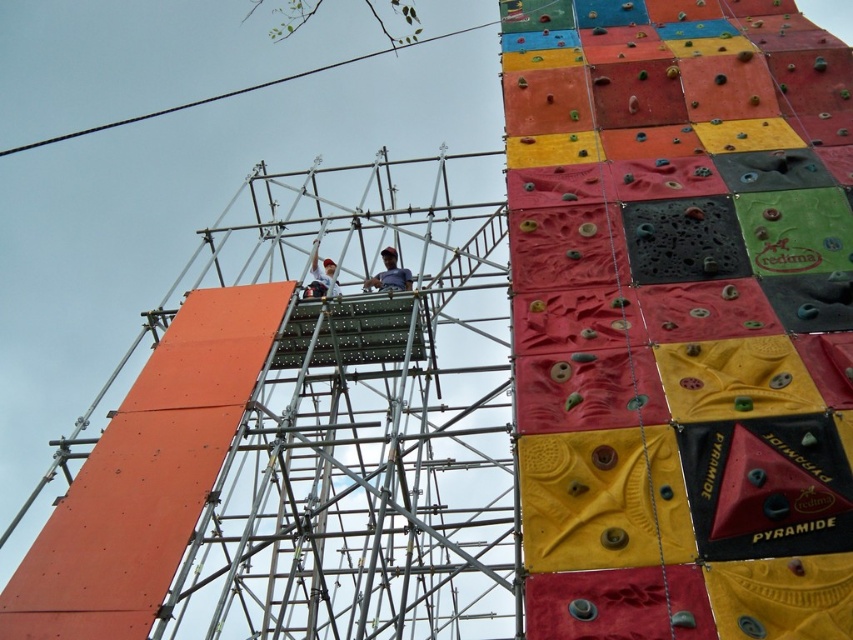
Question: Which object appears farthest from the camera in this image?

Choices:
 (A) metallic scaffolding at center
 (B) matte black helmet at center

Answer: (B)

Question: Can you confirm if metallic scaffolding at center is positioned to the right of white matte shirt at center?

Choices:
 (A) yes
 (B) no

Answer: (B)

Question: Does matte black helmet at center appear under white matte shirt at center?

Choices:
 (A) yes
 (B) no

Answer: (A)

Question: Can you confirm if matte black helmet at center is thinner than white matte shirt at center?

Choices:
 (A) yes
 (B) no

Answer: (B)

Question: Which of the following is the farthest from the observer?

Choices:
 (A) metallic scaffolding at center
 (B) matte black helmet at center
 (C) white matte shirt at center

Answer: (C)

Question: Which point is farther from the camera taking this photo?

Choices:
 (A) (151, 394)
 (B) (392, 276)

Answer: (B)